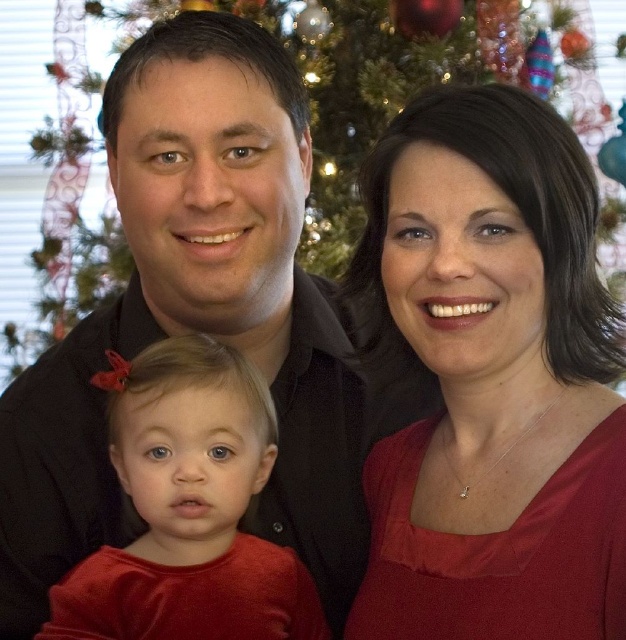
Question: Is matte red dress at center to the left of shiny red dress at lower left from the viewer's perspective?

Choices:
 (A) no
 (B) yes

Answer: (A)

Question: Considering the real-world distances, which object is farthest from the green textured christmas tree at center?

Choices:
 (A) matte red dress at center
 (B) shiny red dress at lower left
 (C) matte black shirt at center

Answer: (B)

Question: Which object appears farthest from the camera in this image?

Choices:
 (A) matte red dress at center
 (B) shiny red dress at lower left
 (C) green textured christmas tree at center

Answer: (C)

Question: Can you confirm if matte red dress at center is positioned to the left of green textured christmas tree at center?

Choices:
 (A) yes
 (B) no

Answer: (B)

Question: Considering the real-world distances, which object is closest to the matte black shirt at center?

Choices:
 (A) matte red dress at center
 (B) shiny red dress at lower left

Answer: (B)

Question: In this image, where is shiny red dress at lower left located relative to green textured christmas tree at center?

Choices:
 (A) left
 (B) right

Answer: (A)